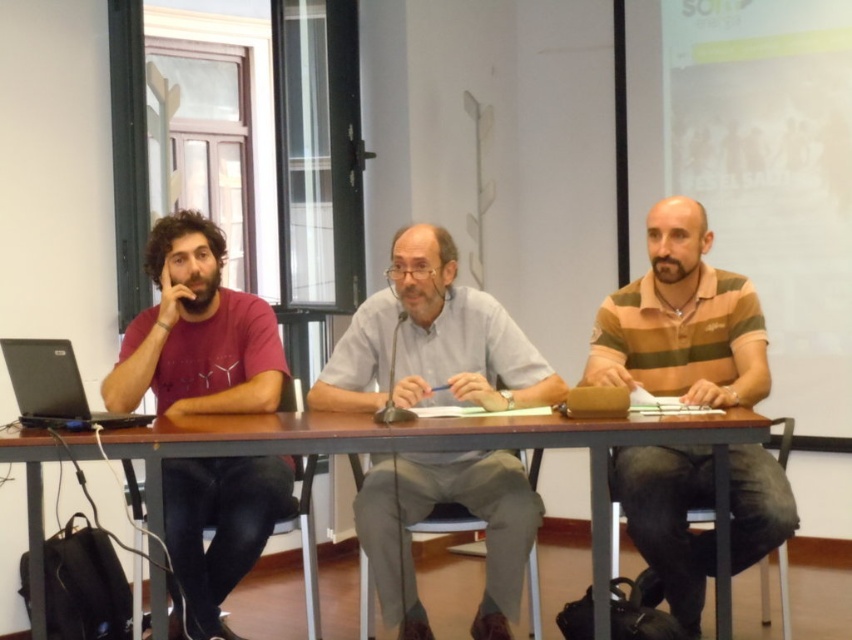
You are standing at the entrance of the conference room and see the matte red shirt at left and the brown leather folder near the rightmost individual. Which object is closer to the entrance based on their coordinates?

The matte red shirt at left is closer to the entrance because its coordinates are at point (196, 332), which are closer to the entrance compared to the brown leather folder near the rightmost individual.

Based on the scene description, is the gray cotton shirt at center positioned higher than the light brown wooden stool at center?

Yes, the gray cotton shirt at center is above the light brown wooden stool at center according to the objects description.

In the scene, there are a gray cotton shirt at center and a light brown wooden stool at center. Which object is taller?

The gray cotton shirt at center is taller than the light brown wooden stool at center.